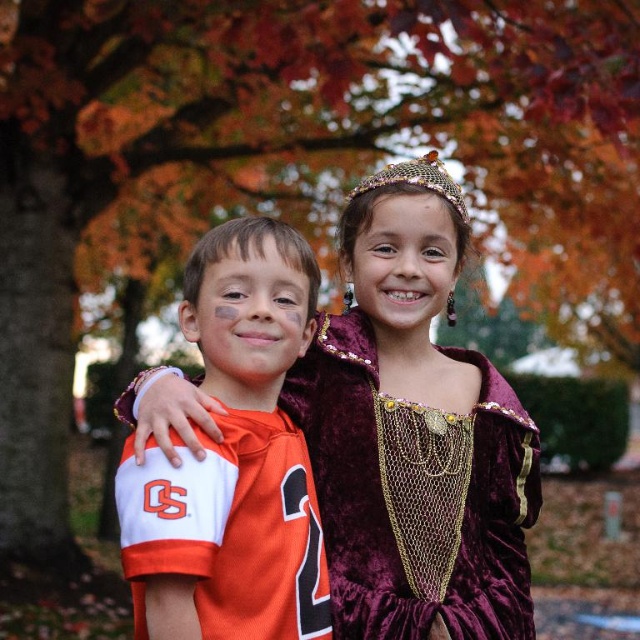
You are a photographer trying to capture a closeup shot of the child in the velvet maroon dress at center. Given that your camera has a focal length of 50mm and you want to maintain a safe distance of at least 1.5 meters from the subject to avoid discomfort, can you determine if you can achieve this while still getting a clear closeup? The child is standing at point coordinates of 0.689, 0.648 in the image frame. Please consider the standard 35mm sensor size and typical depth of field requirements for such

The velvet maroon dress at center is positioned at coordinates (413, 440) in the image frame. With a 50mm lens and a standard 35mm sensor, maintaining a distance of 1.5 meters allows sufficient focus and clarity for a closeup shot without overfilling the frame. The depth of field at this distance should be adequate to keep the subject sharp while keeping the background slightly blurred for aesthetic appeal.

You are organizing a costume parade and need to decide the order of two participants based on their costume widths. The participants are wearing the velvet maroon dress at center and the orange jersey at center. Which costume should be placed first if you want the widest costume to lead the parade?

The velvet maroon dress at center should be placed first because its width surpasses that of the orange jersey at center, making it the wider costume to lead the parade.

You are a photographer setting up for a group photo. You see the velvet maroon dress at center and the gold mesh crown at upper center. Which object should you adjust your camera to focus on first if you want to capture both subjects in the frame?

The gold mesh crown at upper center should be focused on first because it is positioned to the left of the velvet maroon dress at center, making it closer to the camera from the left side.